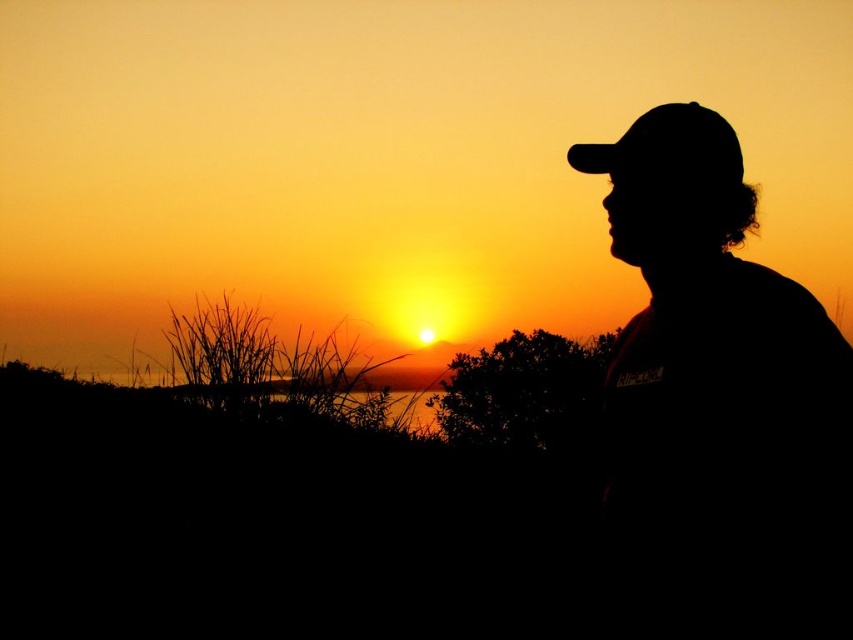
Question: Among these points, which one is nearest to the camera?

Choices:
 (A) (695, 163)
 (B) (715, 193)
 (C) (758, 321)

Answer: (C)

Question: Considering the real-world distances, which object is closest to the black matte baseball hat at upper right?

Choices:
 (A) silhouette cap at right
 (B) black matte cap at right

Answer: (B)

Question: Which point is closer to the camera?

Choices:
 (A) black matte cap at right
 (B) silhouette cap at right

Answer: (B)

Question: Can you confirm if silhouette cap at right is bigger than black matte baseball hat at upper right?

Choices:
 (A) yes
 (B) no

Answer: (A)

Question: Does silhouette cap at right have a lesser width compared to black matte cap at right?

Choices:
 (A) yes
 (B) no

Answer: (B)

Question: Observing the image, what is the correct spatial positioning of silhouette cap at right in reference to black matte baseball hat at upper right?

Choices:
 (A) above
 (B) below

Answer: (B)